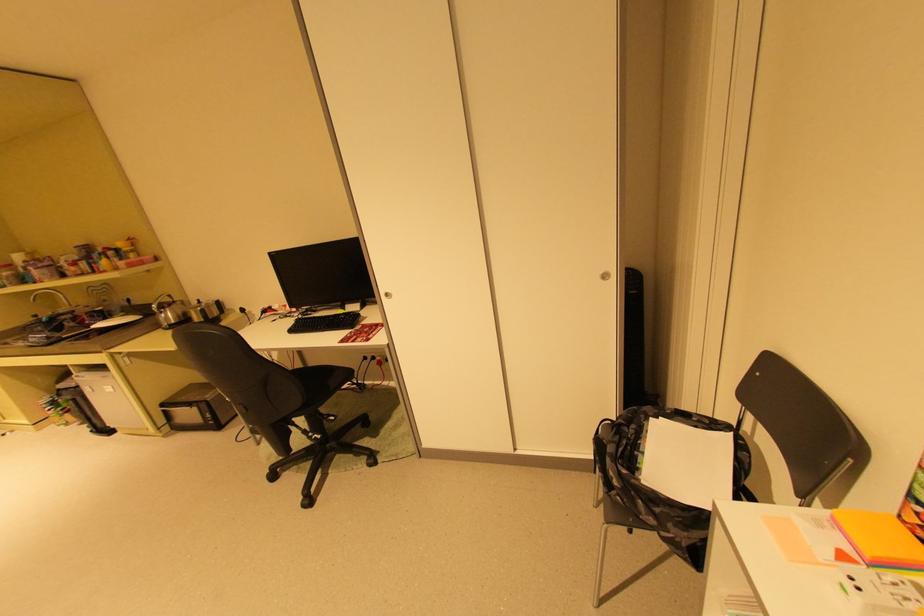
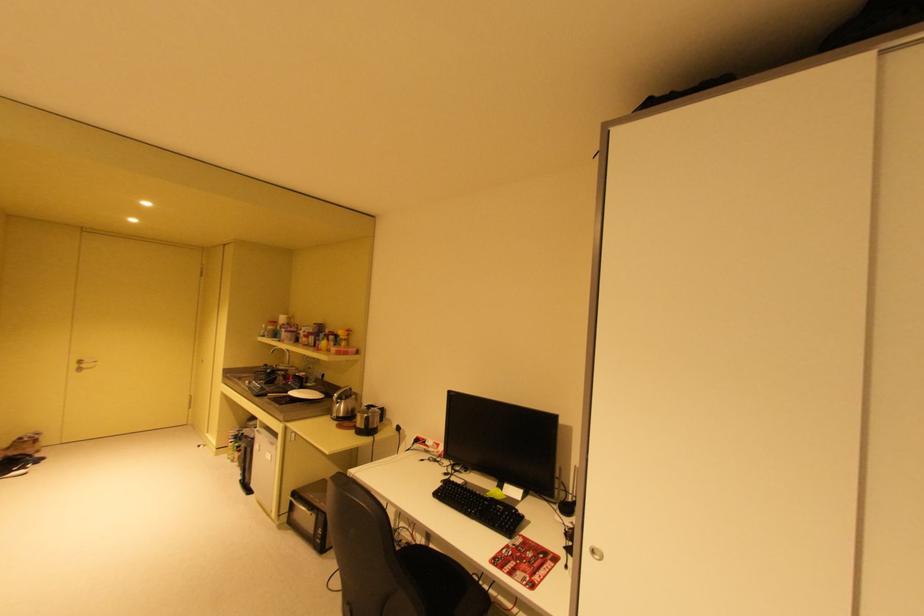
The first image is from the beginning of the video and the second image is from the end. How did the camera likely rotate when shooting the video?

The camera's rotation is toward left-up.